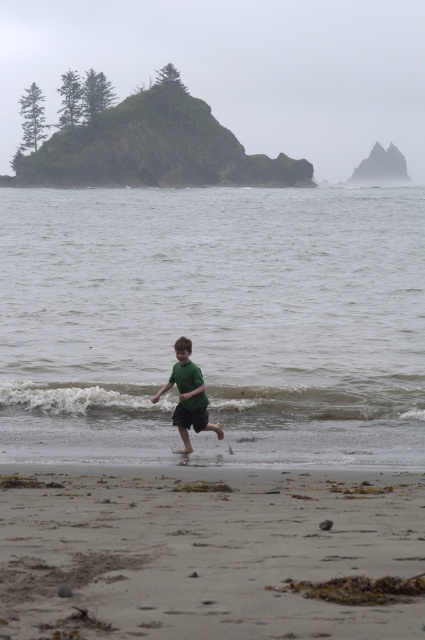
Is green matte water at lower center to the left of green matte shirt at center from the viewer's perspective?

Incorrect, green matte water at lower center is not on the left side of green matte shirt at center.

Can you confirm if green matte water at lower center is smaller than green matte shirt at center?

Incorrect, green matte water at lower center is not smaller in size than green matte shirt at center.

You are a GUI agent. You are given a task and a screenshot of the screen. Output one action in this format:
    pyautogui.click(x=<x>, y=<y>)
    Task: Click on the green matte water at lower center
    The width and height of the screenshot is (425, 640).
    Given the screenshot: What is the action you would take?
    pyautogui.click(x=212, y=320)

Between green matte water at lower center and sandy at lower center, which one appears on the right side from the viewer's perspective?

sandy at lower center

Image resolution: width=425 pixels, height=640 pixels. Describe the element at coordinates (212, 320) in the screenshot. I see `green matte water at lower center` at that location.

You are a GUI agent. You are given a task and a screenshot of the screen. Output one action in this format:
    pyautogui.click(x=<x>, y=<y>)
    Task: Click on the green matte water at lower center
    This screenshot has height=640, width=425.
    Given the screenshot: What is the action you would take?
    pyautogui.click(x=212, y=320)

Can you confirm if sandy at lower center is positioned to the right of green matte shirt at center?

Yes, sandy at lower center is to the right of green matte shirt at center.

Which of these two, sandy at lower center or green matte shirt at center, stands shorter?

Standing shorter between the two is sandy at lower center.

I want to click on sandy at lower center, so (x=204, y=550).